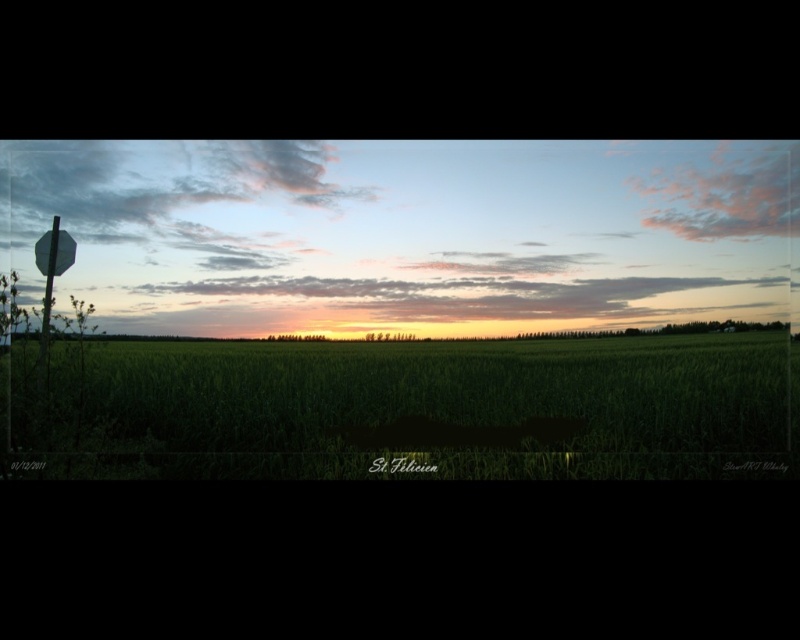
Question: Which object is farther from the camera taking this photo?

Choices:
 (A) metallic stop sign at left
 (B) green grass at center

Answer: (A)

Question: Which object appears farthest from the camera in this image?

Choices:
 (A) green grass at center
 (B) metallic stop sign at left

Answer: (B)

Question: In this image, where is green grass at center located relative to metallic stop sign at left?

Choices:
 (A) right
 (B) left

Answer: (A)

Question: In this image, where is green grass at center located relative to metallic stop sign at left?

Choices:
 (A) below
 (B) above

Answer: (A)

Question: Which of the following is the farthest from the observer?

Choices:
 (A) (56, 246)
 (B) (684, 406)

Answer: (A)

Question: Can you confirm if green grass at center is thinner than metallic stop sign at left?

Choices:
 (A) no
 (B) yes

Answer: (A)